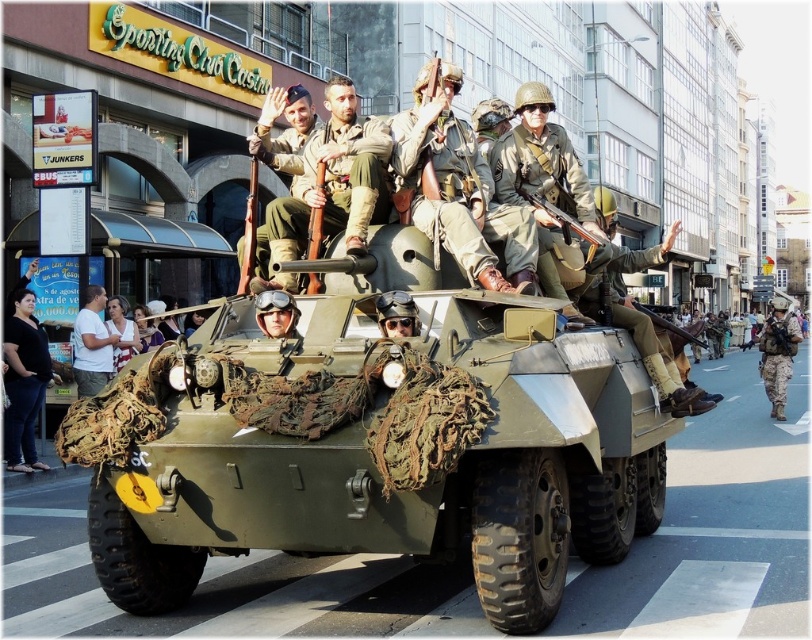
Question: Can you confirm if light brown hair at lower left is positioned to the right of camouflage fabric rifle at center?

Choices:
 (A) no
 (B) yes

Answer: (A)

Question: Considering the relative positions of dark blue jeans at lower left and white t-shirt at lower left in the image provided, where is dark blue jeans at lower left located with respect to white t-shirt at lower left?

Choices:
 (A) above
 (B) below

Answer: (B)

Question: Based on their relative distances, which object is farther from the light brown hair at lower left?

Choices:
 (A) camouflage fabric uniform at center
 (B) matte brown rifle at center

Answer: (B)

Question: Which of the following is the farthest from the observer?

Choices:
 (A) matte brown rifle at center
 (B) light brown hair at lower left

Answer: (B)

Question: Estimate the real-world distances between objects in this image. Which object is farther from the camouflage fabric uniform at right?

Choices:
 (A) light brown hair at lower left
 (B) camouflage fabric rifle at center

Answer: (A)

Question: Can you confirm if camouflage fabric uniform at center is positioned below camouflage fabric rifle at center?

Choices:
 (A) yes
 (B) no

Answer: (B)